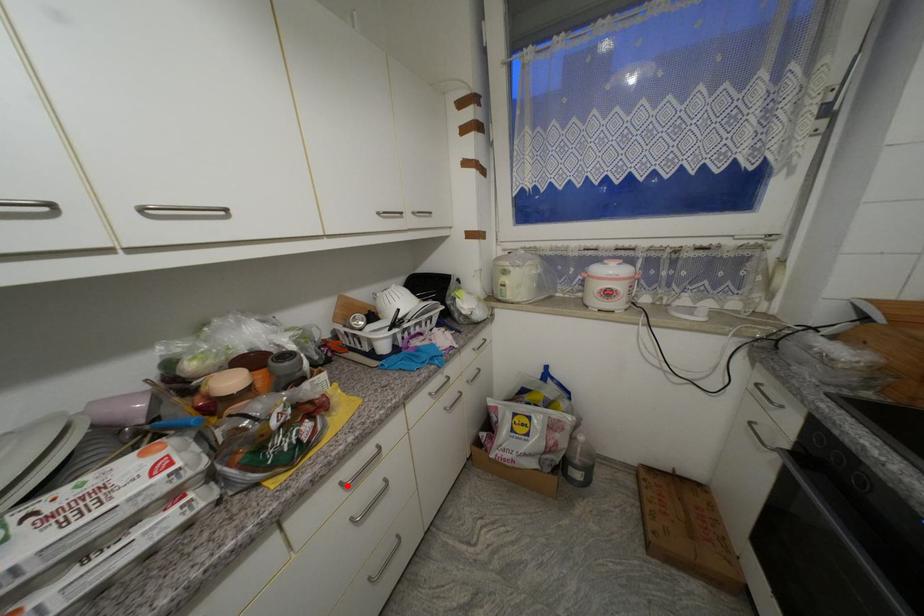
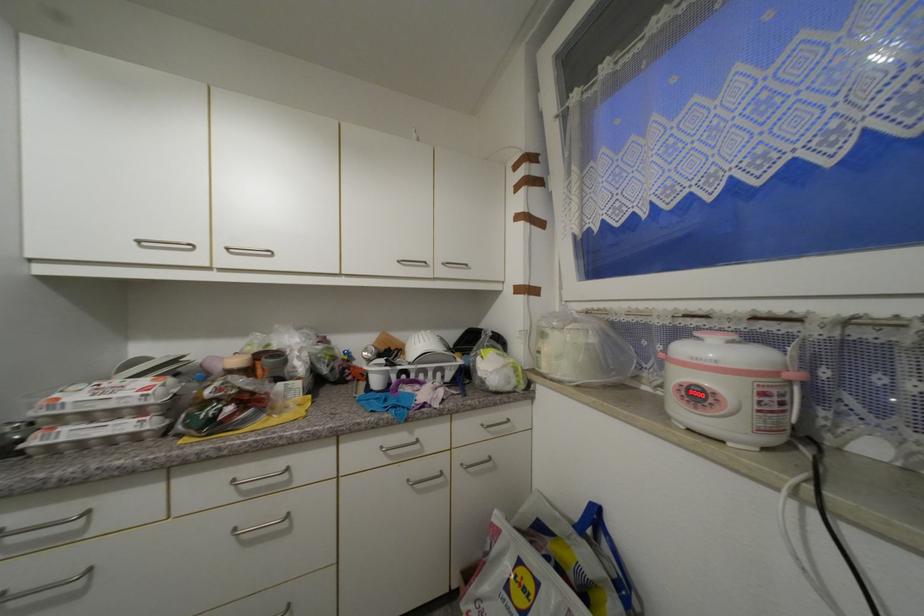
Find the pixel in the second image that matches the highlighted location in the first image.

(238, 483)